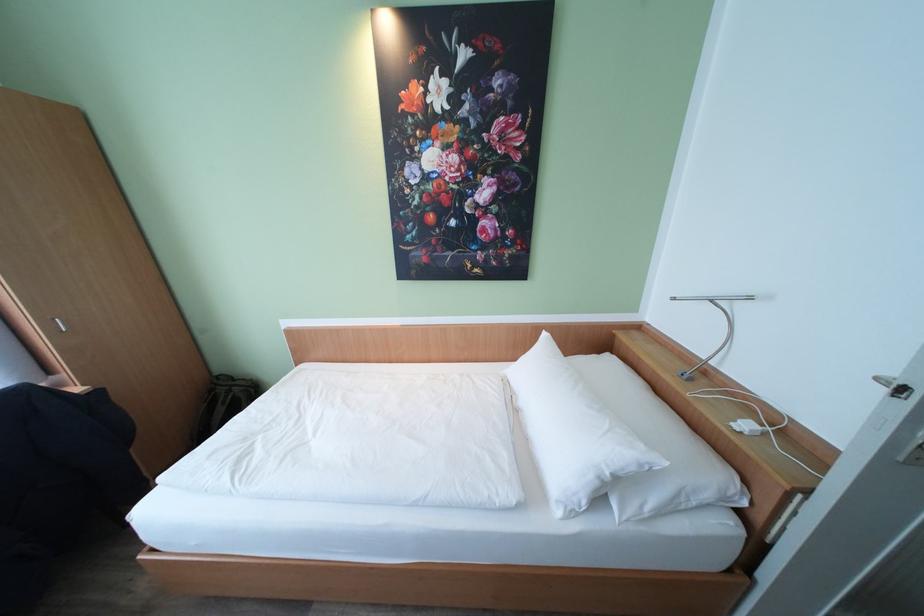
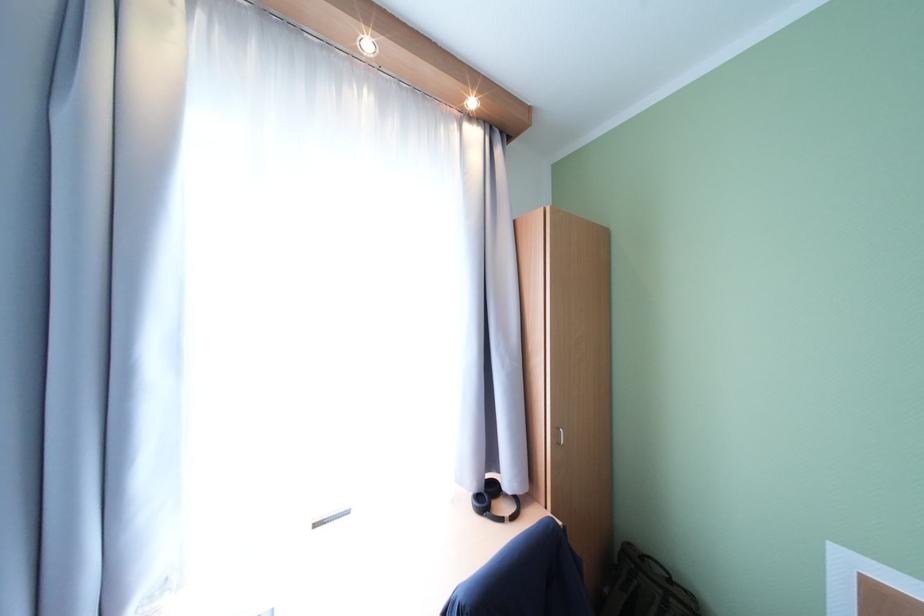
The point at (241, 389) is marked in the first image. Where is the corresponding point in the second image?

(679, 602)